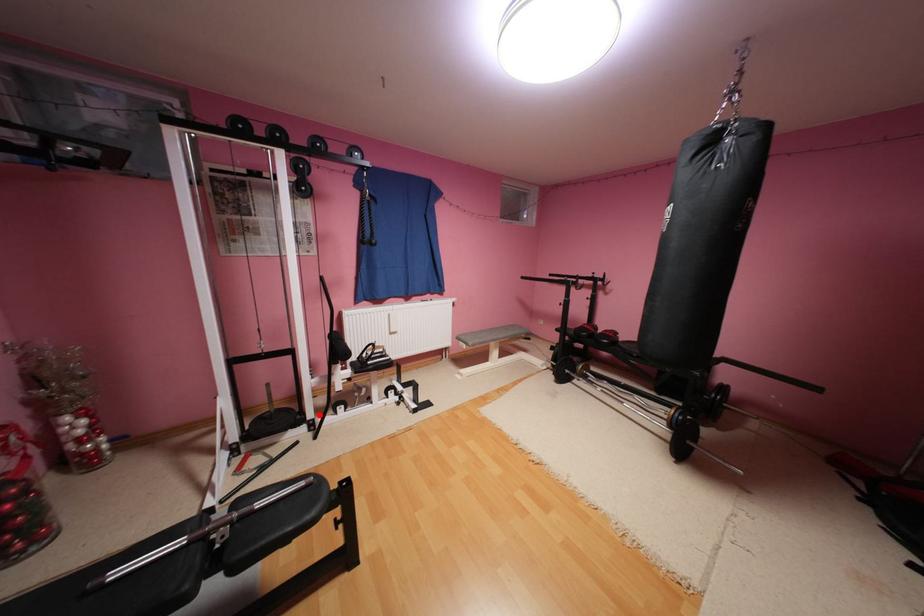
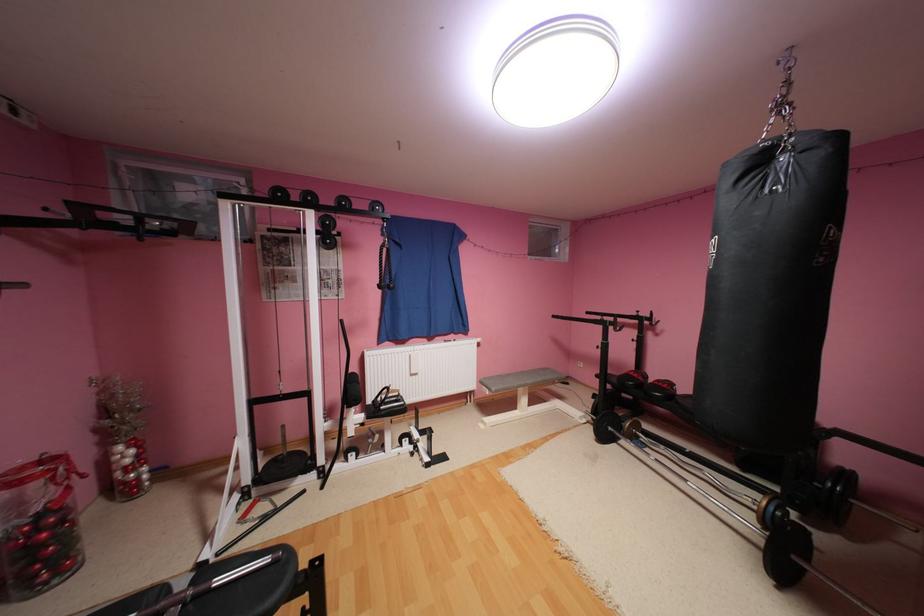
The point at the highlighted location is marked in the first image. Where is the corresponding point in the second image?

(331, 460)